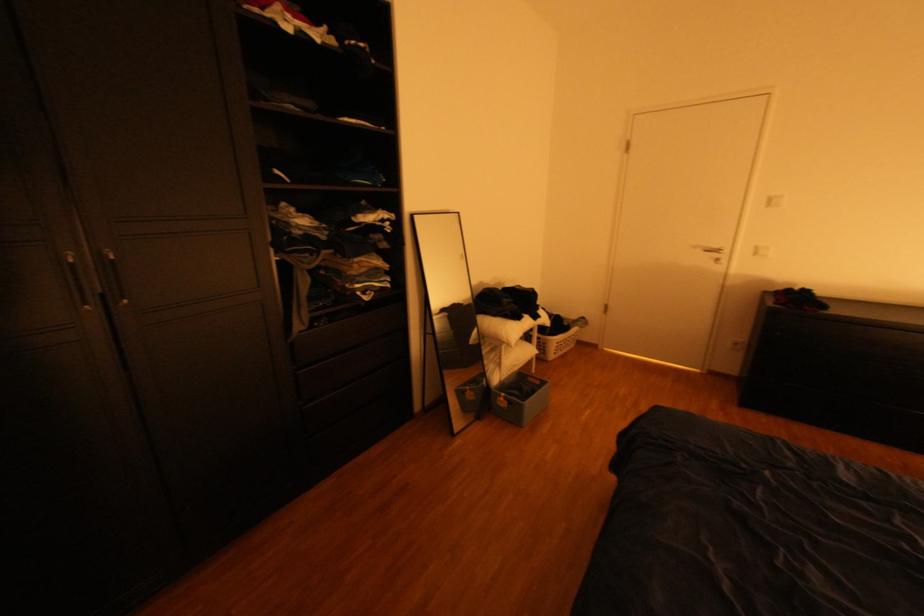
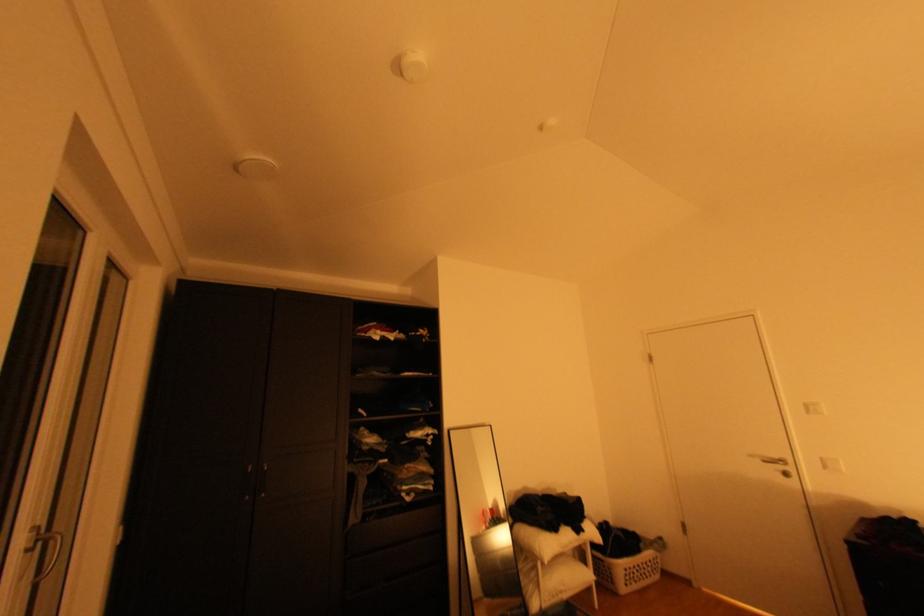
The point at (572, 345) is marked in the first image. Where is the corresponding point in the second image?

(642, 573)